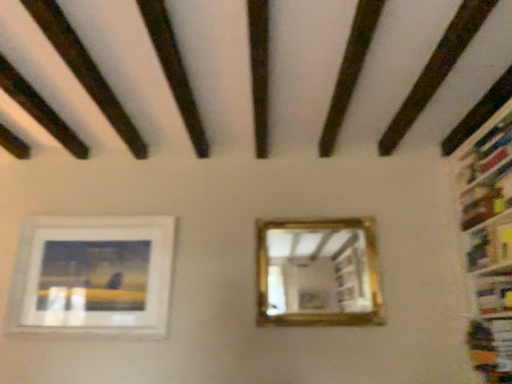
Question: Could gold-framed mirror at center be considered to be inside hardcover book at right, which appears as the second book when viewed from the top?

Choices:
 (A) no
 (B) yes

Answer: (A)

Question: Is hardcover book at right, the first book ordered from the bottom, at the right side of gold-framed mirror at center?

Choices:
 (A) yes
 (B) no

Answer: (A)

Question: Can you confirm if hardcover book at right, the first book ordered from the bottom, is taller than gold-framed mirror at center?

Choices:
 (A) no
 (B) yes

Answer: (A)

Question: Considering the relative sizes of hardcover book at right, the first book ordered from the bottom, and gold-framed mirror at center in the image provided, is hardcover book at right, the first book ordered from the bottom, thinner than gold-framed mirror at center?

Choices:
 (A) no
 (B) yes

Answer: (A)

Question: Can you confirm if hardcover book at right, the first book ordered from the bottom, is positioned to the left of gold-framed mirror at center?

Choices:
 (A) no
 (B) yes

Answer: (A)

Question: Choose the correct answer: Is gold-framed mirror at center inside white matte picture frame at lower left or outside it?

Choices:
 (A) outside
 (B) inside

Answer: (A)

Question: Does point (298, 283) appear closer or farther from the camera than point (88, 294)?

Choices:
 (A) closer
 (B) farther

Answer: (A)

Question: From a real-world perspective, is gold-framed mirror at center above or below white matte picture frame at lower left?

Choices:
 (A) below
 (B) above

Answer: (B)

Question: From their relative heights in the image, would you say gold-framed mirror at center is taller or shorter than white matte picture frame at lower left?

Choices:
 (A) short
 (B) tall

Answer: (A)

Question: In the image, is dark brown wood at upper left positioned in front of or behind hardcover book at right, the first book ordered from the bottom?

Choices:
 (A) front
 (B) behind

Answer: (A)

Question: From the image's perspective, is dark brown wood at upper left located above or below hardcover book at right, which appears as the second book when viewed from the top?

Choices:
 (A) below
 (B) above

Answer: (B)

Question: From a real-world perspective, is dark brown wood at upper left above or below hardcover book at right, which appears as the second book when viewed from the top?

Choices:
 (A) above
 (B) below

Answer: (A)

Question: Do you think dark brown wood at upper left is within hardcover book at right, the first book ordered from the bottom, or outside of it?

Choices:
 (A) inside
 (B) outside

Answer: (B)

Question: Considering their positions, is gold-framed mirror at center located in front of or behind dark brown wood at upper left?

Choices:
 (A) behind
 (B) front

Answer: (A)

Question: Considering the positions of gold-framed mirror at center and dark brown wood at upper left in the image, is gold-framed mirror at center bigger or smaller than dark brown wood at upper left?

Choices:
 (A) small
 (B) big

Answer: (B)